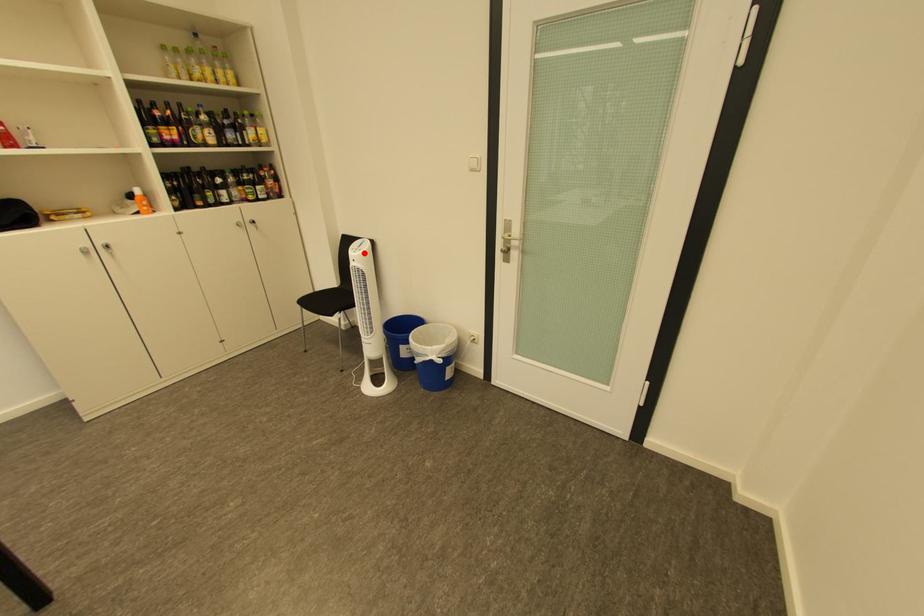
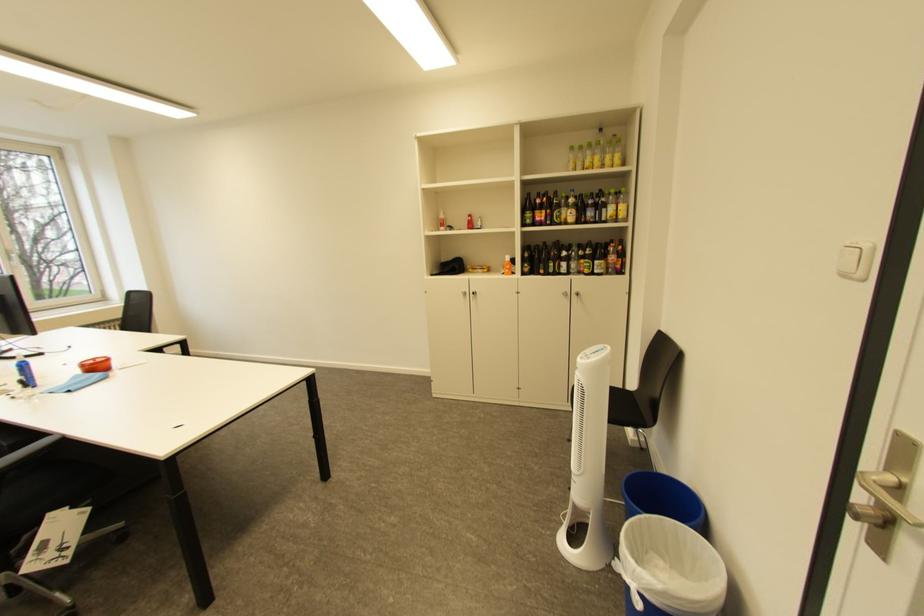
Question: A red point is marked in image1. In image2, is the corresponding 3D point closer to the camera or farther? Reply with the corresponding letter.

Choices:
 (A) The corresponding 3D point is closer.
 (B) The corresponding 3D point is farther.

Answer: (B)